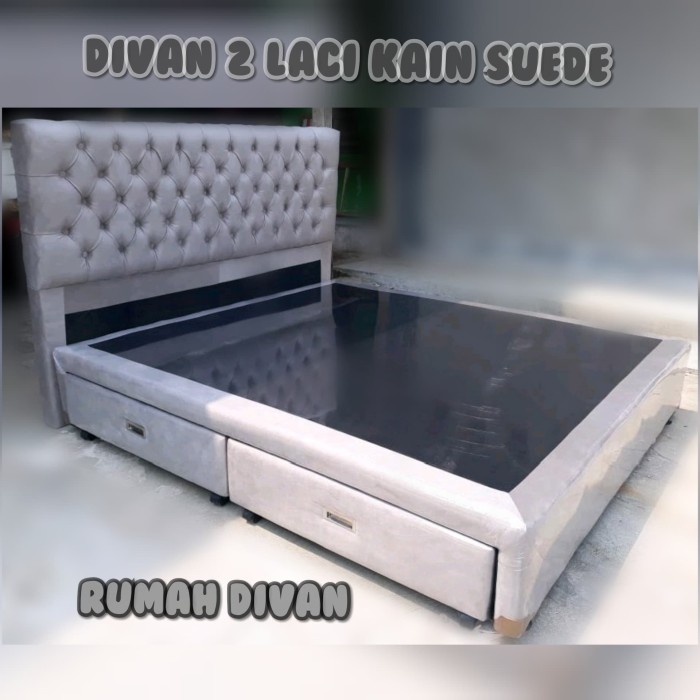
This screenshot has height=700, width=700. I want to click on headboard grey, so coord(195,251).